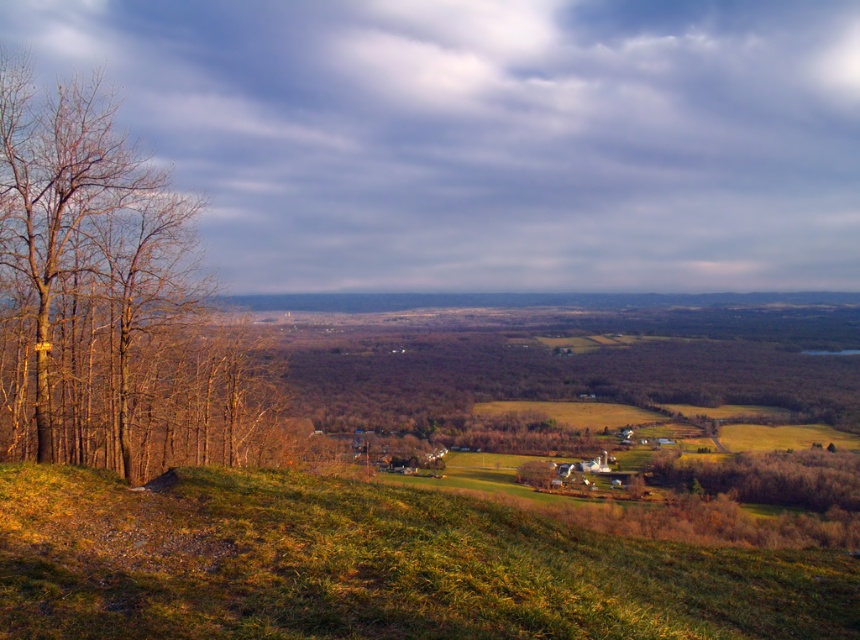
Does bare wood tree at left appear on the right side of green matte tree at center?

In fact, bare wood tree at left is to the left of green matte tree at center.

Consider the image. Who is more distant from viewer, (150, 429) or (550, 465)?

The point (550, 465) is behind.

Where is `bare wood tree at left`? bare wood tree at left is located at coordinates (111, 301).

Is green grassy hillside at lower center positioned in front of bare wood tree at left?

Yes, it is in front of bare wood tree at left.

Looking at this image, is green grassy hillside at lower center above bare wood tree at left?

No, green grassy hillside at lower center is not above bare wood tree at left.

This screenshot has width=860, height=640. Describe the element at coordinates (372, 566) in the screenshot. I see `green grassy hillside at lower center` at that location.

At what (x,y) coordinates should I click in order to perform the action: click on green grassy hillside at lower center. Please return your answer as a coordinate pair (x, y). Looking at the image, I should click on (372, 566).

Consider the image. Can you confirm if green grassy hillside at lower center is positioned to the left of green matte tree at center?

Correct, you'll find green grassy hillside at lower center to the left of green matte tree at center.

Who is taller, green grassy hillside at lower center or green matte tree at center?

green matte tree at center

Does point (809, 595) come closer to viewer compared to point (538, 465)?

Yes, it is.

The image size is (860, 640). Find the location of `green grassy hillside at lower center`. green grassy hillside at lower center is located at coordinates (372, 566).